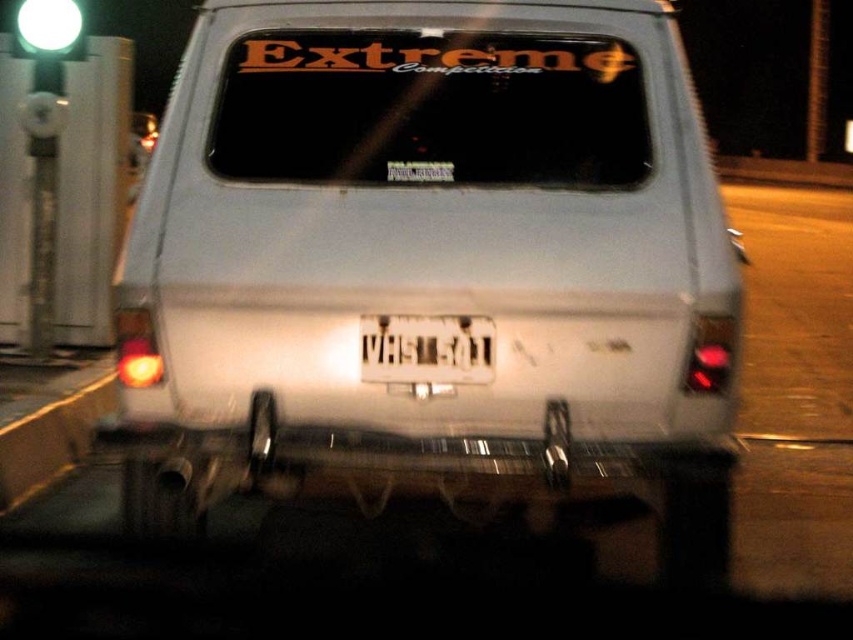
Question: Is white matte van at center closer to the viewer compared to white plastic license plate at center?

Choices:
 (A) no
 (B) yes

Answer: (B)

Question: Which of the following is the farthest from the observer?

Choices:
 (A) white plastic license plate at center
 (B) white matte van at center

Answer: (A)

Question: Can you confirm if white matte van at center is positioned below white plastic license plate at center?

Choices:
 (A) yes
 (B) no

Answer: (B)

Question: Can you confirm if white matte van at center is thinner than white plastic license plate at center?

Choices:
 (A) no
 (B) yes

Answer: (A)

Question: Which point is closer to the camera taking this photo?

Choices:
 (A) (463, 362)
 (B) (260, 132)

Answer: (A)

Question: Which object appears closest to the camera in this image?

Choices:
 (A) white matte van at center
 (B) white plastic license plate at center

Answer: (A)